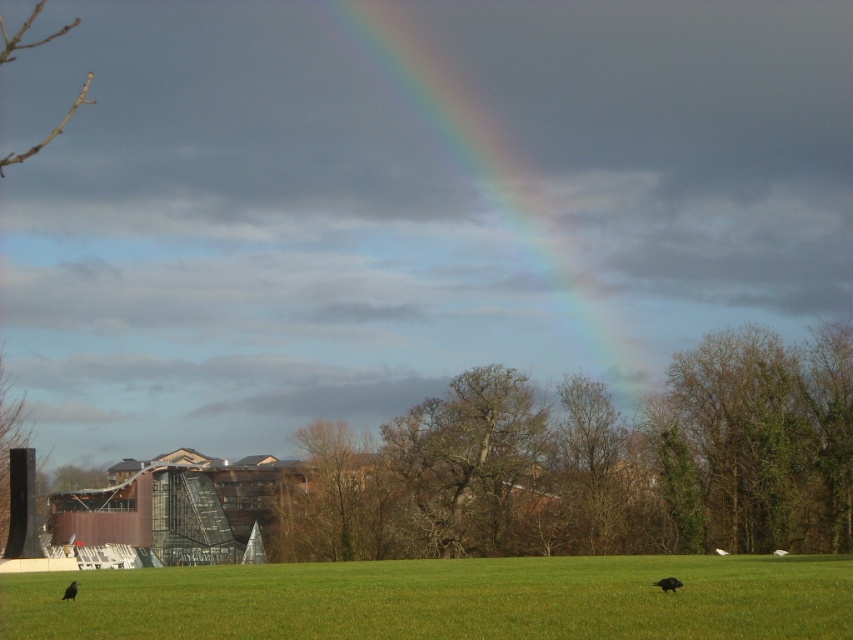
Question: Which point is farther to the camera?

Choices:
 (A) rainbow at upper center
 (B) brown leafless tree at center
 (C) green grass at lower center

Answer: (A)

Question: Which object is the farthest from the shiny black bird at lower right?

Choices:
 (A) rainbow at upper center
 (B) green grass at lower center
 (C) black feathered bird at lower center

Answer: (A)

Question: Where is green grass at lower center located in relation to shiny black bird at lower right in the image?

Choices:
 (A) left
 (B) right

Answer: (A)

Question: Does brown leafless tree at center appear under bare branches at upper left?

Choices:
 (A) no
 (B) yes

Answer: (B)

Question: Which object is closer to the camera taking this photo?

Choices:
 (A) brown leafless tree at center
 (B) bare branches at upper left

Answer: (A)

Question: From the image, what is the correct spatial relationship of brown leafless tree at center in relation to black feathered bird at lower center?

Choices:
 (A) left
 (B) right

Answer: (B)